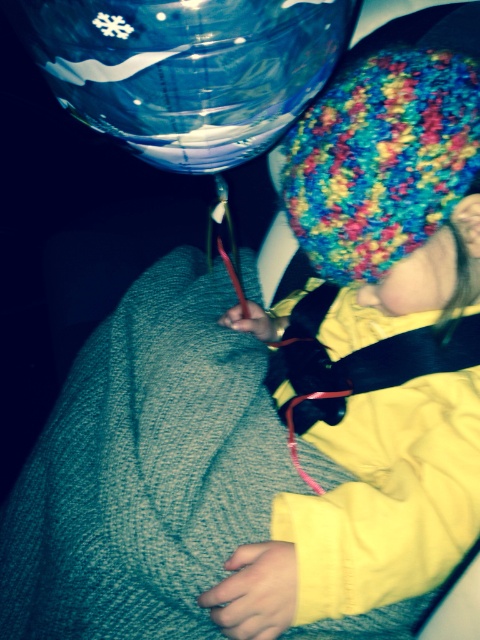
You are a photographer trying to capture the child wearing the knitted multicolor hat at center and the transparent plastic balloon at upper center. Based on their positions, which object should you focus on first to ensure both are in frame?

The knitted multicolor hat at center is taller than the transparent plastic balloon at upper center, so you should focus on the knitted multicolor hat at center first to ensure both are in frame.

You are a photographer trying to capture a clear shot of the child in the image. There are two knitted multicolor hats in view. How far apart are the knitted multicolor hat at center and the multicolored knitted hat at upper right?

The distance between the knitted multicolor hat at center and the multicolored knitted hat at upper right is 9.00 centimeters.

You are a photographer trying to capture the child in the image. The transparent plastic balloon at upper center and the multicolored knitted hat at upper right are blocking your view. To get a clear shot of the child, which object should you move first?

You should move the transparent plastic balloon at upper center first because it is positioned to the left of the multicolored knitted hat at upper right, meaning it is closer to the center and blocking more of the child.